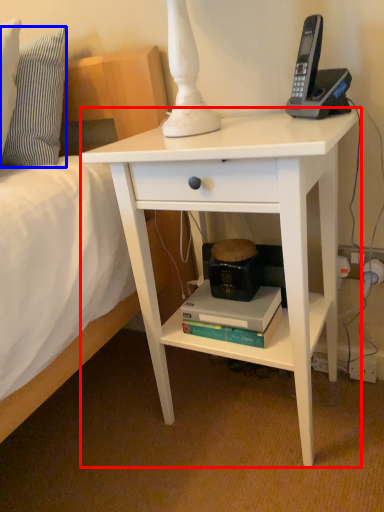
Question: Which of the following is the closest to the observer, desk (highlighted by a red box) or pillow (highlighted by a blue box)?

Choices:
 (A) desk
 (B) pillow

Answer: (A)